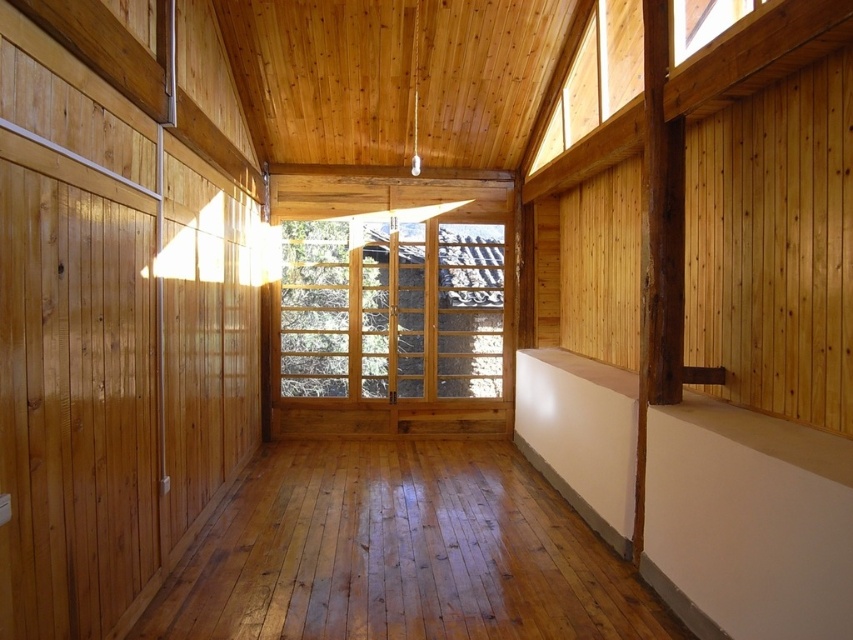
You are standing in the room and want to let more natural light into the space. Which window, the clear glass window at center or the clear glass window at upper right, should you open wider to achieve this?

The clear glass window at center is taller than the clear glass window at upper right, so opening the clear glass window at center wider would allow more natural light into the space since it has a larger opening.

You are a delivery robot with a package that is 4 meters long. You need to move through the space between the clear glass window at center and the clear glass window at upper right. Can you fit through the space between them?

The distance between the clear glass window at center and the clear glass window at upper right is 3.59 meters. Since your package is 4 meters long, it is longer than the available space, so you cannot fit through the space between them.

You are standing at point (677, 13) and want to walk to the large wooden framed sliding door at the far end of the room. Is the point (448, 378) between you and the door?

Point (448, 378) is behind point (677, 13), so it is not between you and the door. You can walk straight to the door without obstacles.